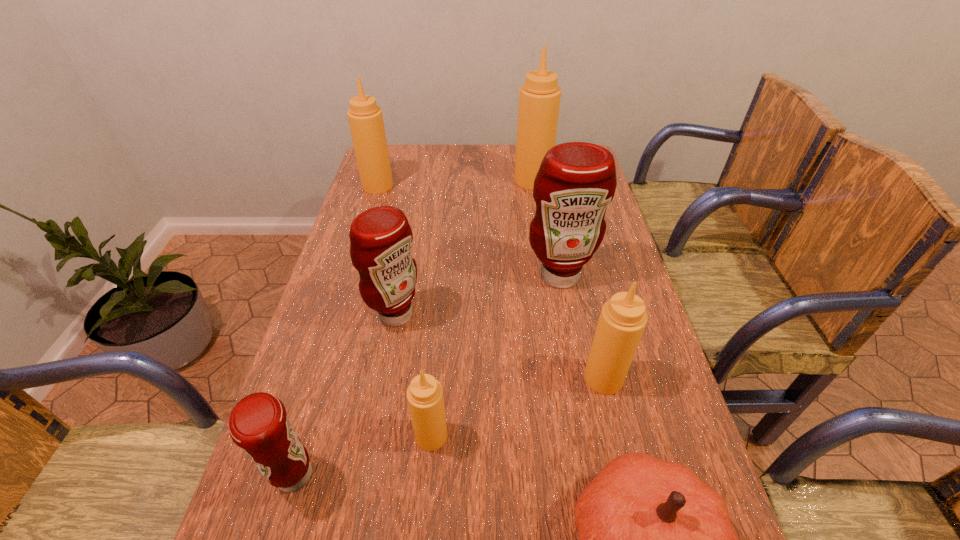
Where is `vacant space that is in between the nearest red condiment and the third nearest condiment`? This screenshot has height=540, width=960. vacant space that is in between the nearest red condiment and the third nearest condiment is located at coordinates tap(449, 427).

Find the location of `unoccupied position between the biggest red condiment and the fourth nearest object`. unoccupied position between the biggest red condiment and the fourth nearest object is located at coordinates (582, 327).

Locate which object is the second closest to the leftmost tan condiment. Please provide its 2D coordinates. Your answer should be formatted as a tuple, i.e. [(x, y)], where the tuple contains the x and y coordinates of a point satisfying the conditions above.

[(381, 239)]

Select which object is the fourth closest to the third nearest condiment. Please provide its 2D coordinates. Your answer should be formatted as a tuple, i.e. [(x, y)], where the tuple contains the x and y coordinates of a point satisfying the conditions above.

[(381, 239)]

Identify which condiment is the seventh nearest to the pink pumpkin. Please provide its 2D coordinates. Your answer should be formatted as a tuple, i.e. [(x, y)], where the tuple contains the x and y coordinates of a point satisfying the conditions above.

[(365, 118)]

Locate an element on the screen. Image resolution: width=960 pixels, height=540 pixels. condiment that is the fourth closest one to the biggest tan condiment is located at coordinates (623, 318).

Locate which tan condiment is the closest to the smallest red condiment. Please provide its 2D coordinates. Your answer should be formatted as a tuple, i.e. [(x, y)], where the tuple contains the x and y coordinates of a point satisfying the conditions above.

[(425, 398)]

The image size is (960, 540). I want to click on tan condiment that stands as the closest to the second biggest tan condiment, so click(539, 99).

Locate an element on the screen. the second closest red condiment to the third smallest tan condiment is located at coordinates (576, 181).

This screenshot has width=960, height=540. What are the coordinates of `the closest red condiment to the pumpkin` in the screenshot? It's located at (381, 239).